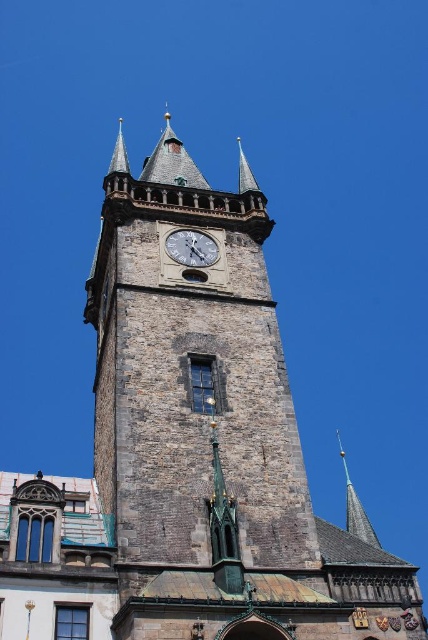
Looking at this image, is silver metallic clock at center shorter than shiny gold spire at upper center?

Yes.

Does silver metallic clock at center appear over shiny gold spire at upper center?

→ Yes, silver metallic clock at center is above shiny gold spire at upper center.

What are the coordinates of `silver metallic clock at center` in the screenshot? It's located at (192, 248).